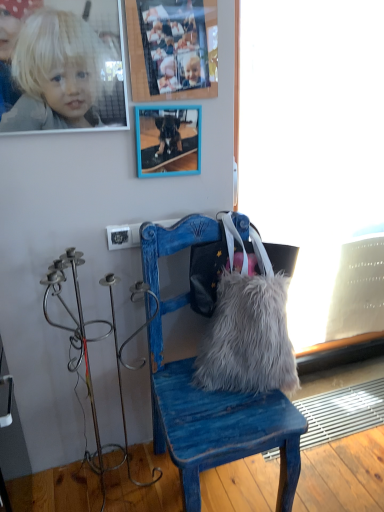
Question: Is wooden photo frame at upper center, placed as the 1th picture frame when sorted from top to bottom, bigger or smaller than frosted glass window screen at right?

Choices:
 (A) big
 (B) small

Answer: (B)

Question: Considering the positions of wooden photo frame at upper center, placed as the 1th picture frame when sorted from top to bottom, and frosted glass window screen at right in the image, is wooden photo frame at upper center, placed as the 1th picture frame when sorted from top to bottom, taller or shorter than frosted glass window screen at right?

Choices:
 (A) tall
 (B) short

Answer: (B)

Question: Which of these objects is positioned farthest from the fuzzy fabric handbag at center?

Choices:
 (A) blue wooden picture frame at upper center, the 2th picture frame viewed from the top
 (B) blonde hair at upper left
 (C) frosted glass window screen at right
 (D) blue wooden chair at center
 (E) wooden photo frame at upper center, placed as the 1th picture frame when sorted from top to bottom

Answer: (B)

Question: Estimate the real-world distances between objects in this image. Which object is closer to the blue wooden picture frame at upper center, the 2th picture frame viewed from the top?

Choices:
 (A) frosted glass window screen at right
 (B) blonde hair at upper left
 (C) blue wooden chair at center
 (D) fuzzy fabric handbag at center
 (E) wooden photo frame at upper center, placed as the 1th picture frame when sorted from top to bottom

Answer: (E)